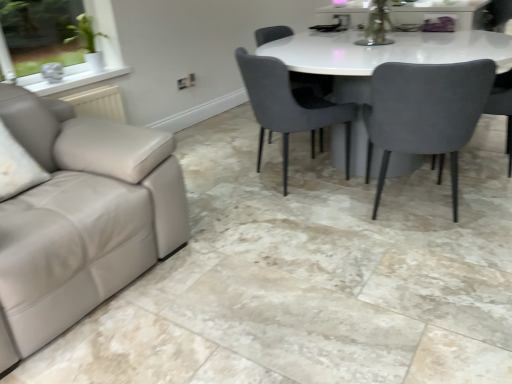
How much space does velvet grey chair at right, which ranks as the 1th chair in right-to-left order, occupy vertically?

The height of velvet grey chair at right, which ranks as the 1th chair in right-to-left order, is 32.55 inches.

What do you see at coordinates (502, 107) in the screenshot? This screenshot has height=384, width=512. I see `velvet grey chair at right, acting as the 4th chair starting from the left` at bounding box center [502, 107].

What is the approximate height of velvet grey chair at center, which is the 1th chair from left to right?

83.05 centimeters.

In order to click on suede gray chair at right, marked as the 2th chair in a right-to-left arrangement in this screenshot , I will do pyautogui.click(x=426, y=113).

Does velvet grey chair at right, acting as the 4th chair starting from the left, have a lesser width compared to velvet grey chair at center, the second chair viewed from the left?

Correct, the width of velvet grey chair at right, acting as the 4th chair starting from the left, is less than that of velvet grey chair at center, the second chair viewed from the left.

Is velvet grey chair at right, which ranks as the 1th chair in right-to-left order, aimed at velvet grey chair at center, the second chair viewed from the left?

Yes, velvet grey chair at right, which ranks as the 1th chair in right-to-left order, is facing velvet grey chair at center, the second chair viewed from the left.

Is velvet grey chair at right, which ranks as the 1th chair in right-to-left order, in front of or behind velvet grey chair at center, the second chair viewed from the left, in the image?

Clearly, velvet grey chair at right, which ranks as the 1th chair in right-to-left order, is in front of velvet grey chair at center, the second chair viewed from the left.

Based on their positions, is velvet grey chair at right, acting as the 4th chair starting from the left, located to the left or right of velvet grey chair at center, positioned as the third chair in right-to-left order?

Based on their positions, velvet grey chair at right, acting as the 4th chair starting from the left, is located to the right of velvet grey chair at center, positioned as the third chair in right-to-left order.

Is velvet grey chair at right, which ranks as the 1th chair in right-to-left order, bigger than velvet grey chair at center, which appears as the 4th chair when viewed from the right?

Incorrect, velvet grey chair at right, which ranks as the 1th chair in right-to-left order, is not larger than velvet grey chair at center, which appears as the 4th chair when viewed from the right.

From the picture: Is velvet grey chair at right, which ranks as the 1th chair in right-to-left order, to the right of velvet grey chair at center, which is the 1th chair from left to right, from the viewer's perspective?

Correct, you'll find velvet grey chair at right, which ranks as the 1th chair in right-to-left order, to the right of velvet grey chair at center, which is the 1th chair from left to right.

Find the location of a particular element. chair that is the 1st object located below the velvet grey chair at right, acting as the 4th chair starting from the left (from the image's perspective) is located at coordinates (289, 106).

Is velvet grey chair at right, acting as the 4th chair starting from the left, beside velvet grey chair at center, which appears as the 4th chair when viewed from the right?

No, velvet grey chair at right, acting as the 4th chair starting from the left, is not in contact with velvet grey chair at center, which appears as the 4th chair when viewed from the right.

From a real-world perspective, count 3rd chairs upward from the velvet grey chair at right, acting as the 4th chair starting from the left, and point to it. Please provide its 2D coordinates.

[(313, 82)]

Is velvet grey chair at center, positioned as the third chair in right-to-left order, taller than velvet grey chair at right, acting as the 4th chair starting from the left?

Yes.

Which object is closer to the camera taking this photo, velvet grey chair at center, positioned as the third chair in right-to-left order, or velvet grey chair at right, which ranks as the 1th chair in right-to-left order?

velvet grey chair at right, which ranks as the 1th chair in right-to-left order.

From the image's perspective, is suede gray chair at right, marked as the 2th chair in a right-to-left arrangement, above or below velvet grey chair at right, which ranks as the 1th chair in right-to-left order?

Based on their image positions, suede gray chair at right, marked as the 2th chair in a right-to-left arrangement, is located beneath velvet grey chair at right, which ranks as the 1th chair in right-to-left order.

Which object is closer to the camera taking this photo, suede gray chair at right, arranged as the third chair when viewed from the left, or velvet grey chair at right, acting as the 4th chair starting from the left?

suede gray chair at right, arranged as the third chair when viewed from the left, is closer to the camera.

Locate an element on the screen. the 1st chair directly above the velvet grey chair at right, which ranks as the 1th chair in right-to-left order (from a real-world perspective) is located at coordinates (426, 113).

In terms of width, does suede gray chair at right, arranged as the third chair when viewed from the left, look wider or thinner when compared to velvet grey chair at right, which ranks as the 1th chair in right-to-left order?

In the image, suede gray chair at right, arranged as the third chair when viewed from the left, appears to be wider than velvet grey chair at right, which ranks as the 1th chair in right-to-left order.

From the image's perspective, is velvet grey chair at center, which is the 1th chair from left to right, under velvet grey chair at center, the second chair viewed from the left?

Yes, from the image's perspective, velvet grey chair at center, which is the 1th chair from left to right, is beneath velvet grey chair at center, the second chair viewed from the left.

In terms of size, does velvet grey chair at center, which is the 1th chair from left to right, appear bigger or smaller than velvet grey chair at center, the second chair viewed from the left?

velvet grey chair at center, which is the 1th chair from left to right, is smaller than velvet grey chair at center, the second chair viewed from the left.

Does velvet grey chair at center, which appears as the 4th chair when viewed from the right, appear on the right side of velvet grey chair at center, positioned as the third chair in right-to-left order?

In fact, velvet grey chair at center, which appears as the 4th chair when viewed from the right, is to the left of velvet grey chair at center, positioned as the third chair in right-to-left order.

Based on the photo, does velvet grey chair at right, which ranks as the 1th chair in right-to-left order, have a lesser height compared to suede gray chair at right, arranged as the third chair when viewed from the left?

Correct, velvet grey chair at right, which ranks as the 1th chair in right-to-left order, is not as tall as suede gray chair at right, arranged as the third chair when viewed from the left.

Is velvet grey chair at right, which ranks as the 1th chair in right-to-left order, placed right next to suede gray chair at right, marked as the 2th chair in a right-to-left arrangement?

No, velvet grey chair at right, which ranks as the 1th chair in right-to-left order, is not in contact with suede gray chair at right, marked as the 2th chair in a right-to-left arrangement.

From the image's perspective, is velvet grey chair at right, acting as the 4th chair starting from the left, positioned above or below suede gray chair at right, arranged as the third chair when viewed from the left?

Based on their image positions, velvet grey chair at right, acting as the 4th chair starting from the left, is located above suede gray chair at right, arranged as the third chair when viewed from the left.

Is velvet grey chair at right, acting as the 4th chair starting from the left, facing towards suede gray chair at right, marked as the 2th chair in a right-to-left arrangement?

No, velvet grey chair at right, acting as the 4th chair starting from the left, does not turn towards suede gray chair at right, marked as the 2th chair in a right-to-left arrangement.

Could you tell me if velvet grey chair at center, the second chair viewed from the left, is turned towards velvet grey chair at center, which is the 1th chair from left to right?

No, velvet grey chair at center, the second chair viewed from the left, does not turn towards velvet grey chair at center, which is the 1th chair from left to right.

Is velvet grey chair at center, the second chair viewed from the left, located outside velvet grey chair at center, which is the 1th chair from left to right?

Indeed, velvet grey chair at center, the second chair viewed from the left, is completely outside velvet grey chair at center, which is the 1th chair from left to right.

Which point is more forward, (317, 81) or (304, 89)?

The point (304, 89) is closer.

Looking at this image, how much distance is there between velvet grey chair at center, positioned as the third chair in right-to-left order, and velvet grey chair at center, which is the 1th chair from left to right?

velvet grey chair at center, positioned as the third chair in right-to-left order, and velvet grey chair at center, which is the 1th chair from left to right, are 28.58 inches apart from each other.

Where is `the 1st chair in front of the velvet grey chair at center, positioned as the third chair in right-to-left order, starting your count from the anchor`? the 1st chair in front of the velvet grey chair at center, positioned as the third chair in right-to-left order, starting your count from the anchor is located at coordinates coord(502,107).

Find the location of a particular element. the 2nd chair above the velvet grey chair at right, which ranks as the 1th chair in right-to-left order (from a real-world perspective) is located at coordinates (289, 106).

Considering their positions, is velvet grey chair at center, the second chair viewed from the left, positioned further to velvet grey chair at right, acting as the 4th chair starting from the left, than suede gray chair at right, marked as the 2th chair in a right-to-left arrangement?

Among the two, velvet grey chair at center, the second chair viewed from the left, is located further to velvet grey chair at right, acting as the 4th chair starting from the left.

From the image, which object appears to be nearer to velvet grey chair at center, the second chair viewed from the left, suede gray chair at right, marked as the 2th chair in a right-to-left arrangement, or velvet grey chair at center, which appears as the 4th chair when viewed from the right?

velvet grey chair at center, which appears as the 4th chair when viewed from the right, is closer to velvet grey chair at center, the second chair viewed from the left.

From the image, which object appears to be farther from suede gray chair at right, marked as the 2th chair in a right-to-left arrangement, velvet grey chair at center, which is the 1th chair from left to right, or velvet grey chair at right, acting as the 4th chair starting from the left?

Based on the image, velvet grey chair at right, acting as the 4th chair starting from the left, appears to be further to suede gray chair at right, marked as the 2th chair in a right-to-left arrangement.

Looking at the image, which one is located further to suede gray chair at right, marked as the 2th chair in a right-to-left arrangement, velvet grey chair at center, positioned as the third chair in right-to-left order, or velvet grey chair at right, which ranks as the 1th chair in right-to-left order?

The object further to suede gray chair at right, marked as the 2th chair in a right-to-left arrangement, is velvet grey chair at right, which ranks as the 1th chair in right-to-left order.

Looking at the image, which one is located further to velvet grey chair at right, which ranks as the 1th chair in right-to-left order, suede gray chair at right, arranged as the third chair when viewed from the left, or velvet grey chair at center, which appears as the 4th chair when viewed from the right?

velvet grey chair at center, which appears as the 4th chair when viewed from the right, is further to velvet grey chair at right, which ranks as the 1th chair in right-to-left order.

Looking at the image, which one is located further to velvet grey chair at center, positioned as the third chair in right-to-left order, velvet grey chair at center, which is the 1th chair from left to right, or suede gray chair at right, arranged as the third chair when viewed from the left?

Based on the image, suede gray chair at right, arranged as the third chair when viewed from the left, appears to be further to velvet grey chair at center, positioned as the third chair in right-to-left order.

When comparing their distances from suede gray chair at right, marked as the 2th chair in a right-to-left arrangement, does velvet grey chair at right, which ranks as the 1th chair in right-to-left order, or velvet grey chair at center, the second chair viewed from the left, seem further?

The object further to suede gray chair at right, marked as the 2th chair in a right-to-left arrangement, is velvet grey chair at right, which ranks as the 1th chair in right-to-left order.

When comparing their distances from velvet grey chair at right, acting as the 4th chair starting from the left, does velvet grey chair at center, which is the 1th chair from left to right, or velvet grey chair at center, positioned as the third chair in right-to-left order, seem further?

velvet grey chair at center, which is the 1th chair from left to right, lies further to velvet grey chair at right, acting as the 4th chair starting from the left, than the other object.

The width and height of the screenshot is (512, 384). What are the coordinates of `chair located between velvet grey chair at center, positioned as the third chair in right-to-left order, and velvet grey chair at right, acting as the 4th chair starting from the left, in the left-right direction` in the screenshot? It's located at (426, 113).